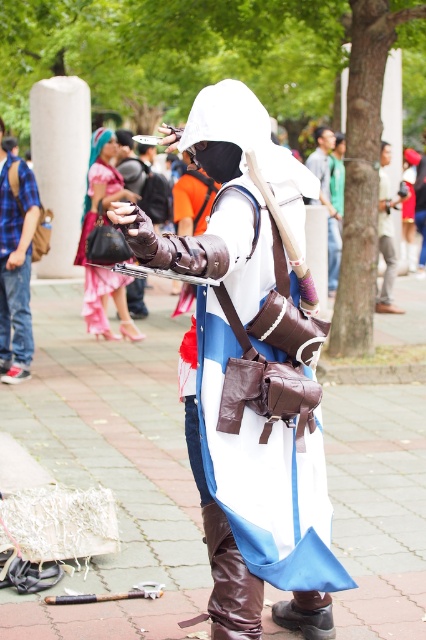
From the picture: You are organizing a cosplay photoshoot and need to arrange props. The white leather gloves at center and the brushed metal backpack at left are both part of the setup. Based on their sizes, which object should be placed closer to the camera to ensure both fit within the frame without overcrowding?

The white leather gloves at center are wider than the brushed metal backpack at left. To avoid overcrowding, place the white leather gloves at center closer to the camera since their larger width requires more space in the frame.

You are a photographer at the event and want to capture a photo of the white leather gloves at center and the brushed metal backpack at left. Based on their positions, which object should you focus on first if you want to ensure both are in the frame without moving the camera?

The white leather gloves at center is below the brushed metal backpack at left, so you should focus on the brushed metal backpack at left first to ensure both are in the frame without moving the camera.

You are at an event and want to take a photo of the white leather gloves at center and the brushed metal backpack at left. Which object should you focus on first to ensure both are in the frame?

You should focus on the white leather gloves at center first because it is closer to the viewer than the brushed metal backpack at left, so adjusting the camera to capture the closer object ensures both are in the frame.